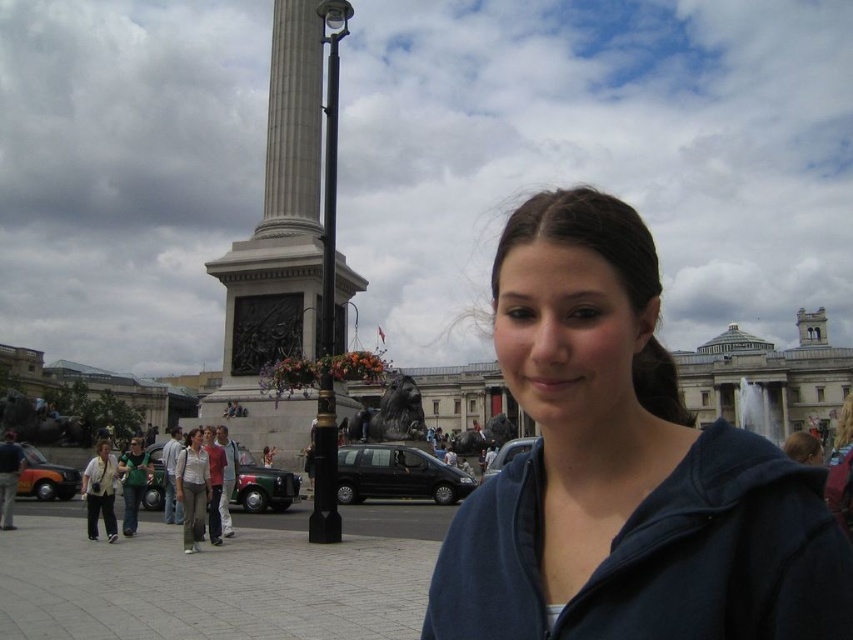
You are a photographer trying to capture the blue fleece jacket at center in your shot. The camera you are using has a focal length of 50mm and an aperture of f2.8. Based on the scene description and the jacket location, what is the minimum distance you need to be from the jacket to ensure it fills the frame appropriately?

The minimum distance required to ensure the blue fleece jacket at center fills the frame appropriately can be calculated using the formula for depth of field and field of view. However, without specific dimensions of the jacket or sensor size, an exact distance cannot be determined. The jacket is located at coordinates [624,468], so positioning the camera directly facing this point would optimize framing.

You are a photographer trying to capture the monument in the background without any obstructions. You notice the blue fleece jacket at center and the light brown pants at lower left in your frame. Which object should you move to ensure the monument is visible?

You should move the blue fleece jacket at center because it is in front of the light brown pants at lower left and would block the view of the monument in the background.

You are a photographer trying to capture the woman in the blue fleece jacket at center and the light brown pants at lower left. Which of the two items should you focus on first if you want to start with the one closer to the camera?

The blue fleece jacket at center is located above light brown pants at lower left, so it is closer to the camera. Focus on the blue fleece jacket at center first.